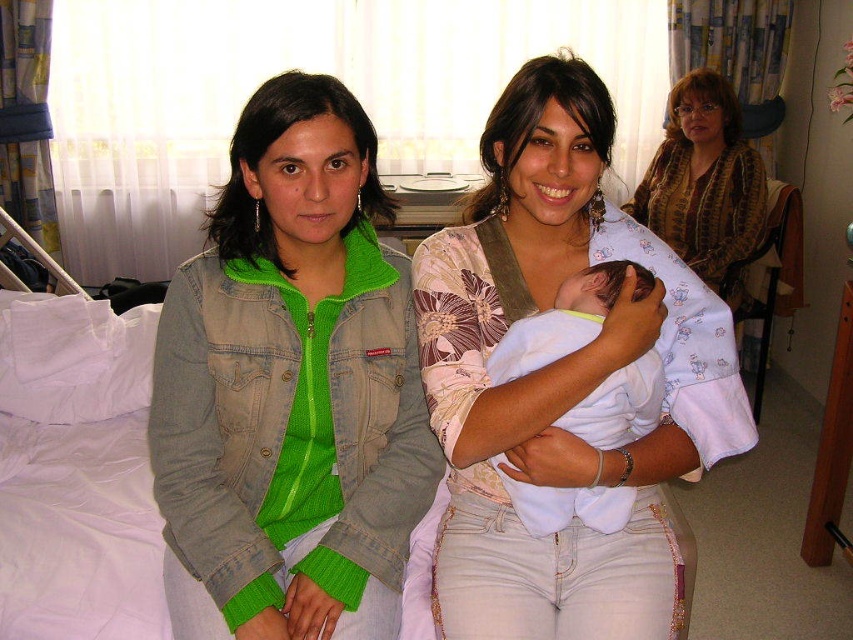
You are standing in the hospital room and need to reach the green denim jacket at left. Which direction should you move from your current position to get it?

The green denim jacket at left is located at point 0.606 on the x and 0.341 on the y, so you should move towards the lower right direction to reach it.

Looking at this image, you are a nurse in the hospital room. You need to retrieve the green denim jacket at left to give to the patient. However, there is a patterned fabric baby at upper right in the way. Can you reach the jacket without moving the baby?

The green denim jacket at left is positioned under the patterned fabric baby at upper right, so you can reach the jacket without moving the baby since it is located below the baby.

In the hospital room scene, there is a green denim jacket at left and a white cotton baby at center. From the perspective of someone standing at the entrance of the room, which object is closer to the viewer?

The green denim jacket at left is closer to the viewer because the white cotton baby at center is positioned behind it.